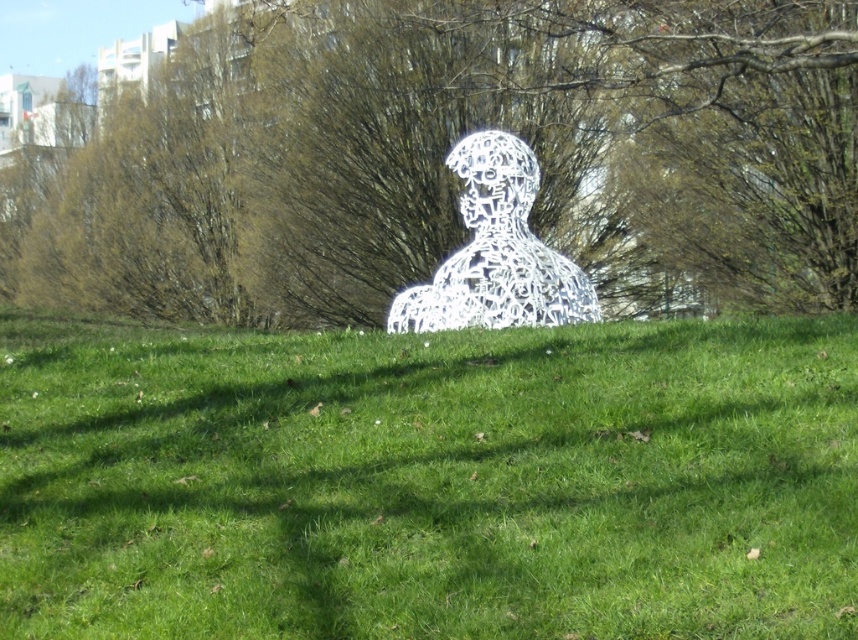
You are standing in the grassy area and want to take a photo of the sculpture. Which object, the green grass at center or the green leafy tree at center, is closer to the camera?

The green grass at center is closer to the camera because it has a lesser height compared to the green leafy tree at center, meaning the grass is lower and thus nearer in the scene.

You are a gardener who needs to water both the green leafy tree at center and the white metallic sculpture at center. If your watering can has a range of 3 meters, can you water both objects without moving closer?

The distance between the green leafy tree at center and the white metallic sculpture at center is 3.28 meters, which is beyond the 3 meter range of the watering can. Therefore, you cannot water both objects without moving closer.